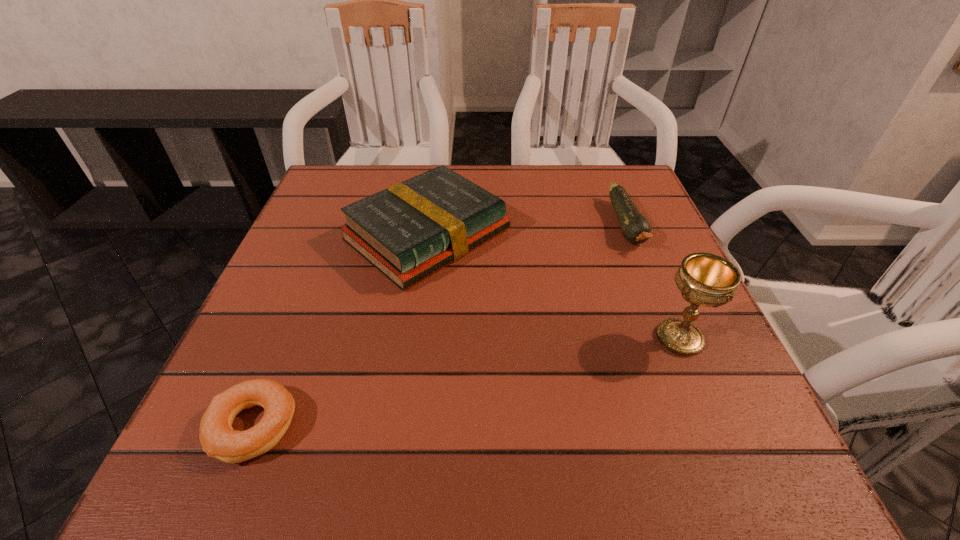
Image resolution: width=960 pixels, height=540 pixels. Find the location of `hardback book present at the far edge`. hardback book present at the far edge is located at coordinates (410, 230).

You are a GUI agent. You are given a task and a screenshot of the screen. Output one action in this format:
    pyautogui.click(x=<x>, y=<y>)
    Task: Click on the zucchini at the far edge
    The height and width of the screenshot is (540, 960).
    Given the screenshot: What is the action you would take?
    pyautogui.click(x=635, y=228)

In order to click on object located at the near edge in this screenshot , I will do `click(219, 440)`.

Image resolution: width=960 pixels, height=540 pixels. What are the coordinates of `hardback book at the left edge` in the screenshot? It's located at (410, 230).

I want to click on bagel at the left edge, so click(x=219, y=440).

The height and width of the screenshot is (540, 960). I want to click on chalice positioned at the right edge, so click(x=704, y=279).

What are the coordinates of `zucchini positioned at the right edge` in the screenshot? It's located at (635, 228).

Locate an element on the screen. object situated at the far left corner is located at coordinates (410, 230).

You are a GUI agent. You are given a task and a screenshot of the screen. Output one action in this format:
    pyautogui.click(x=<x>, y=<y>)
    Task: Click on the object that is at the near left corner
    Image resolution: width=960 pixels, height=540 pixels.
    Given the screenshot: What is the action you would take?
    click(x=219, y=440)

The height and width of the screenshot is (540, 960). Identify the location of object at the far right corner. (635, 228).